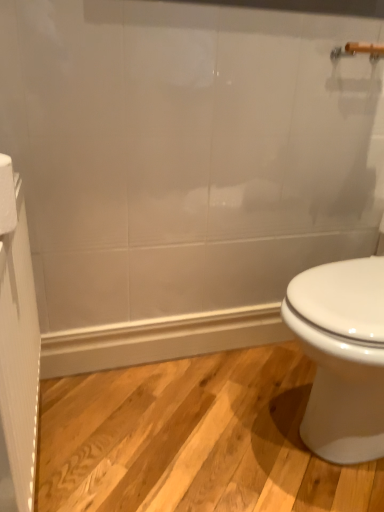
What do you see at coordinates (7, 196) in the screenshot?
I see `white paper towel at left` at bounding box center [7, 196].

Where is `white paper towel at left`? This screenshot has width=384, height=512. white paper towel at left is located at coordinates (7, 196).

This screenshot has width=384, height=512. Identify the location of white textured screen door at left. (17, 349).

The width and height of the screenshot is (384, 512). What do you see at coordinates (17, 349) in the screenshot?
I see `white textured screen door at left` at bounding box center [17, 349].

Locate an element on the screen. Image resolution: width=384 pixels, height=512 pixels. white paper towel at left is located at coordinates (7, 196).

Visually, is white textured screen door at left positioned to the left or to the right of white paper towel at left?

white textured screen door at left is to the left of white paper towel at left.

Does white textured screen door at left lie behind white paper towel at left?

No, it is in front of white paper towel at left.

Which is closer, (17, 291) or (4, 206)?

The point (4, 206) is closer to the camera.

From the image's perspective, does white textured screen door at left appear higher than white paper towel at left?

Incorrect, from the image's perspective, white textured screen door at left is lower than white paper towel at left.

From the picture: From a real-world perspective, is white textured screen door at left under white paper towel at left?

Correct, in the physical world, white textured screen door at left is lower than white paper towel at left.

Is white textured screen door at left wider than white paper towel at left?

No.

Who is taller, white textured screen door at left or white paper towel at left?

With more height is white textured screen door at left.

Based on the photo, who is smaller, white textured screen door at left or white paper towel at left?

With smaller size is white paper towel at left.

Is white textured screen door at left situated inside white paper towel at left or outside?

white textured screen door at left cannot be found inside white paper towel at left.

Can you see white textured screen door at left touching white paper towel at left?

white textured screen door at left and white paper towel at left are not in contact.

Consider the image. Is white textured screen door at left oriented towards white paper towel at left?

No, white textured screen door at left is not turned towards white paper towel at left.

The height and width of the screenshot is (512, 384). Identify the location of screen door located below the white paper towel at left (from the image's perspective). (17, 349).

Considering the positions of objects white paper towel at left and white textured screen door at left in the image provided, who is more to the right, white paper towel at left or white textured screen door at left?

From the viewer's perspective, white paper towel at left appears more on the right side.

Which is in front, white paper towel at left or white textured screen door at left?

white textured screen door at left is more forward.

Does point (15, 213) lie in front of point (6, 170)?

That is False.

From the image's perspective, is white paper towel at left positioned above or below white textured screen door at left?

white paper towel at left is situated higher than white textured screen door at left in the image.

From a real-world perspective, is white paper towel at left physically located above or below white textured screen door at left?

white paper towel at left is above white textured screen door at left.

Between white paper towel at left and white textured screen door at left, which one has larger width?

With larger width is white paper towel at left.

Who is shorter, white paper towel at left or white textured screen door at left?

white paper towel at left.

In terms of size, does white paper towel at left appear bigger or smaller than white textured screen door at left?

In the image, white paper towel at left appears to be smaller than white textured screen door at left.

Is white textured screen door at left inside white paper towel at left?

No, white textured screen door at left is not a part of white paper towel at left.

Is white paper towel at left placed right next to white textured screen door at left?

No, white paper towel at left is not in contact with white textured screen door at left.

Is white paper towel at left facing towards white textured screen door at left?

No, white paper towel at left is not oriented towards white textured screen door at left.

Measure the distance between white paper towel at left and white textured screen door at left.

They are 9.12 inches apart.

The height and width of the screenshot is (512, 384). I want to click on screen door below the white paper towel at left (from the image's perspective), so click(x=17, y=349).

The width and height of the screenshot is (384, 512). Find the location of `toilet paper on the right of the white textured screen door at left`. toilet paper on the right of the white textured screen door at left is located at coordinates (7, 196).

Find the location of a particular element. The image size is (384, 512). toilet paper behind the white textured screen door at left is located at coordinates (7, 196).